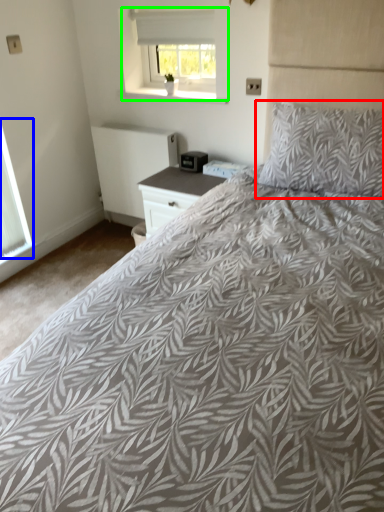
Question: Based on their relative distances, which object is nearer to pillow (highlighted by a red box)? Choose from window (highlighted by a blue box) and window (highlighted by a green box).

Choices:
 (A) window
 (B) window

Answer: (B)